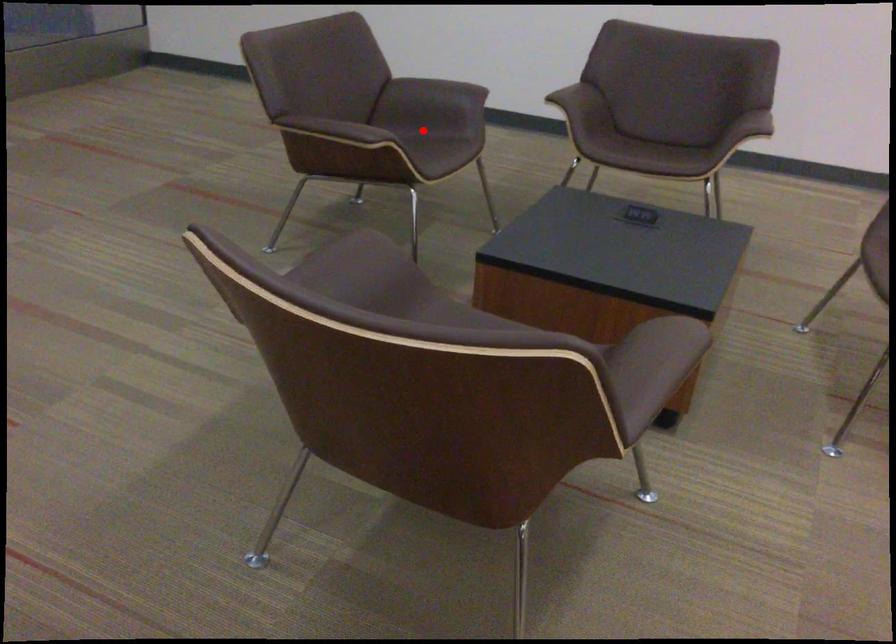
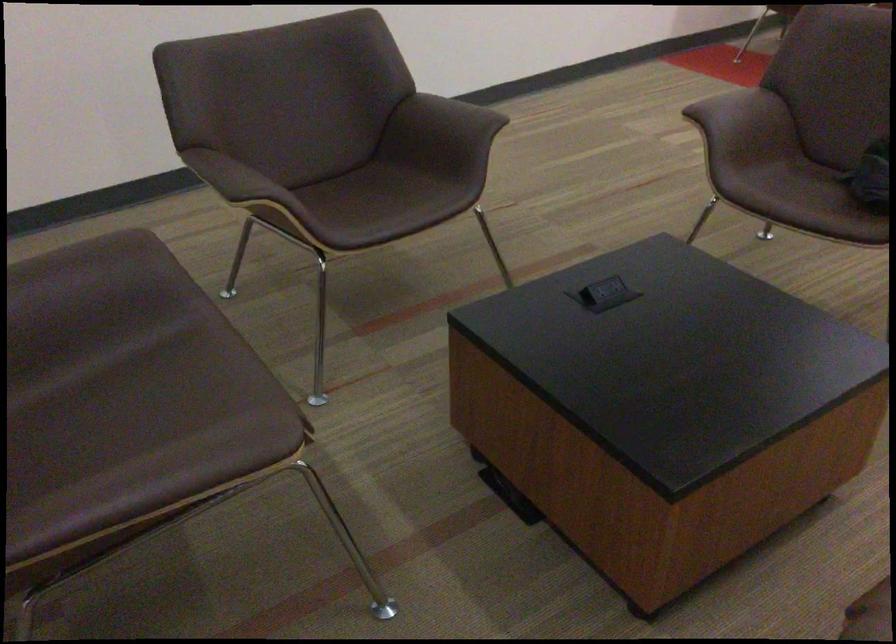
Question: I am providing you with two images of the same scene from different viewpoints. Image1 has a red point marked. In image2, the corresponding 3D location appears at what relative position? Reply with the corresponding letter.

Choices:
 (A) Closer
 (B) Farther

Answer: (A)